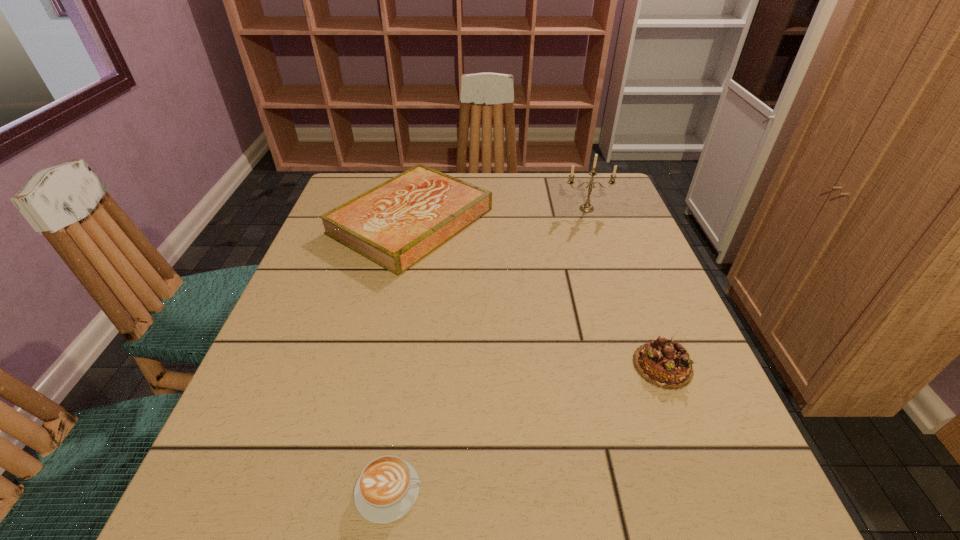
In the image, there is a desktop. Identify the location of vacant region at the right edge. The height and width of the screenshot is (540, 960). (663, 471).

Where is `vacant space at the far left corner of the desktop`? The width and height of the screenshot is (960, 540). vacant space at the far left corner of the desktop is located at coordinates (372, 179).

In the image, there is a desktop. At what (x,y) coordinates should I click in order to perform the action: click on vacant space at the far right corner. Please return your answer as a coordinate pair (x, y). This screenshot has height=540, width=960. Looking at the image, I should click on click(x=583, y=199).

The image size is (960, 540). Identify the location of vacant space at the near right corner of the desktop. (695, 537).

Identify the location of free space between the nearest object and the chocolate cake. (526, 428).

Find the location of a particular element. This screenshot has height=540, width=960. unoccupied area between the tallest object and the nearest object is located at coordinates (488, 349).

Where is `free space between the candle and the hardback book`? This screenshot has width=960, height=540. free space between the candle and the hardback book is located at coordinates (499, 215).

The image size is (960, 540). Find the location of `free point between the tallest object and the hardback book`. free point between the tallest object and the hardback book is located at coordinates (499, 215).

You are a GUI agent. You are given a task and a screenshot of the screen. Output one action in this format:
    pyautogui.click(x=<x>, y=<y>)
    Task: Click on the free space between the cappuccino and the candle
    The width and height of the screenshot is (960, 540).
    Given the screenshot: What is the action you would take?
    pyautogui.click(x=488, y=349)

At what (x,y) coordinates should I click in order to perform the action: click on free space between the shortest object and the tallest object. Please return your answer as a coordinate pair (x, y). Looking at the image, I should click on (488, 349).